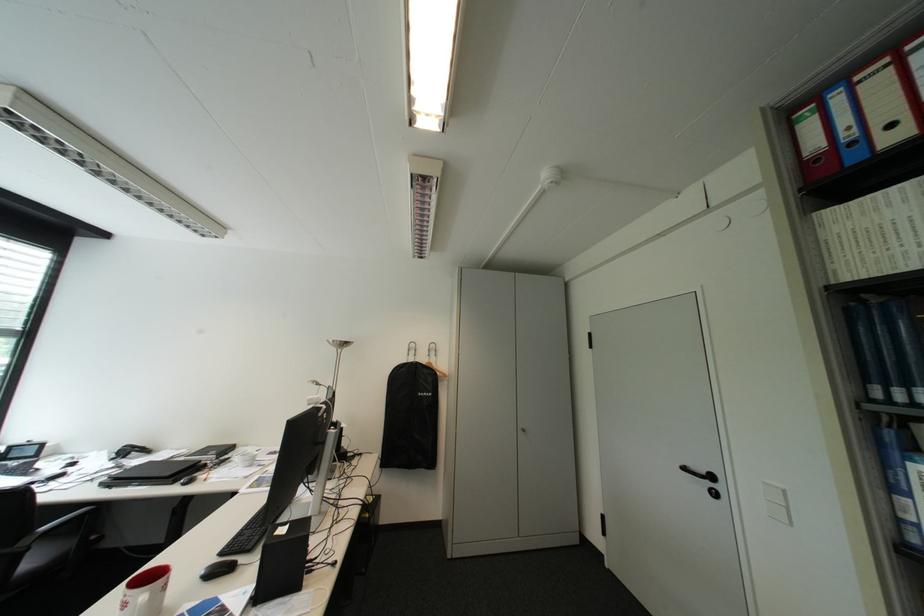
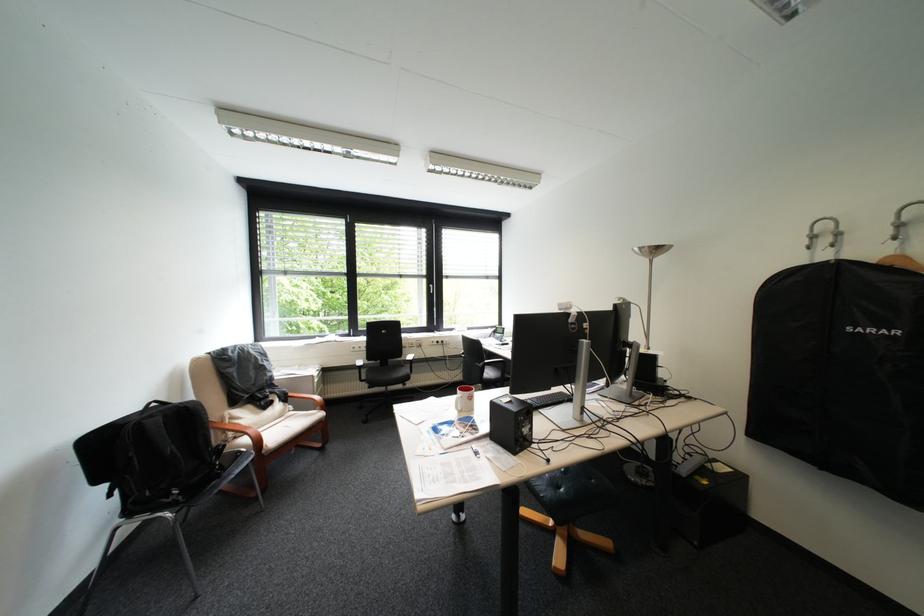
Locate, in the second image, the point that corresponds to point (424, 353) in the first image.

(837, 241)